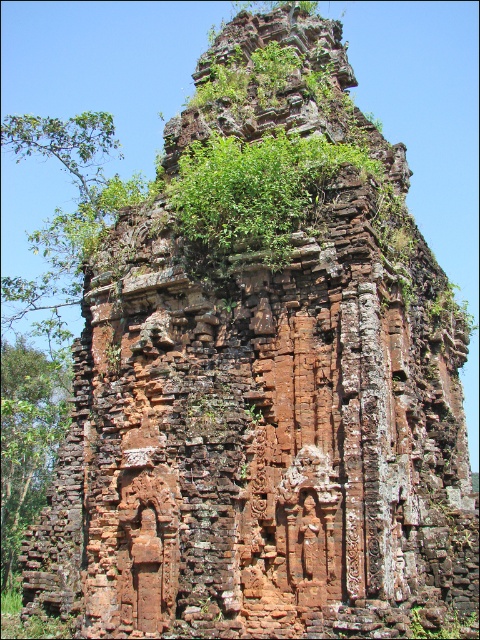
Question: Is green leafy plant at center to the left of green leafy tree at left from the viewer's perspective?

Choices:
 (A) no
 (B) yes

Answer: (A)

Question: Is green leafy plant at center further to camera compared to green leafy tree at left?

Choices:
 (A) yes
 (B) no

Answer: (B)

Question: Which object is farther from the camera taking this photo?

Choices:
 (A) green leafy plant at center
 (B) green leafy tree at left

Answer: (B)

Question: Does green leafy plant at center have a larger size compared to green leafy tree at left?

Choices:
 (A) no
 (B) yes

Answer: (A)